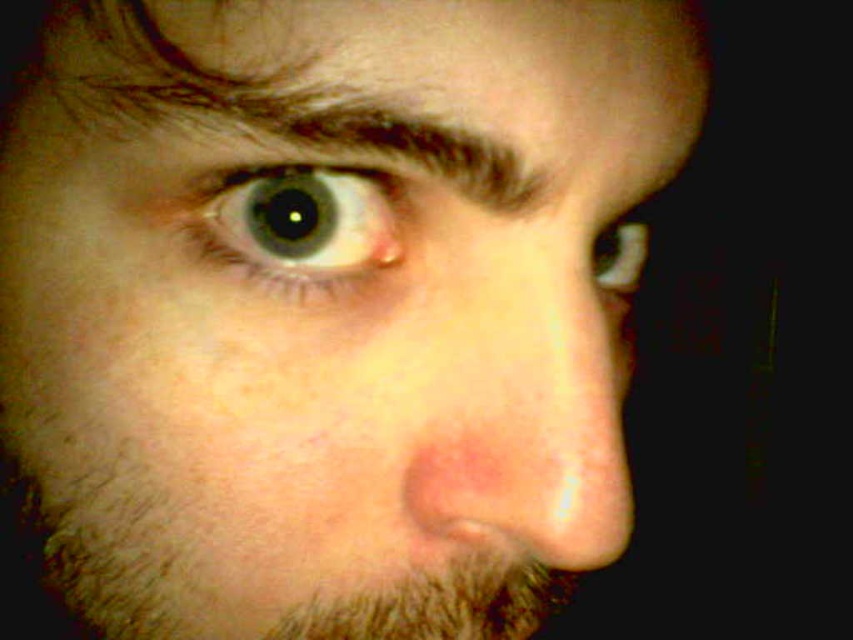
You are a photographer trying to capture a close detail shot of the person in the image. You need to focus on the brown fuzzy beard at lower left located at point (91,554). However, your camera can only focus on one specific point. Is the point you want to focus on within the area of the brown fuzzy beard at lower left?

The point (91,554) is where the brown fuzzy beard at lower left is located, so yes, focusing at that point will capture the brown fuzzy beard at lower left.

You are a photographer adjusting lighting for a portrait. You need to ensure that both the brown hair at upper left and the brown fuzzy beard at lower left are well lit. Based on their positions, which object should you focus the light on first to ensure both areas are illuminated adequately?

The brown hair at upper left is positioned over brown fuzzy beard at lower left. To ensure both areas are well lit, focus the light on the brown hair at upper left first, as it is above the beard and will cast shadows if not properly illuminated.

You are a makeup artist preparing to apply eyeliner to the light blue glossy eye at upper left. You need to ensure you don not accidentally apply it to the brown fuzzy beard at lower left. Based on the image, how far apart are these two features?

The brown fuzzy beard at lower left is 10.64 centimeters away from the light blue glossy eye at upper left, so you can safely apply eyeliner to the light blue glossy eye at upper left without affecting the brown fuzzy beard at lower left.